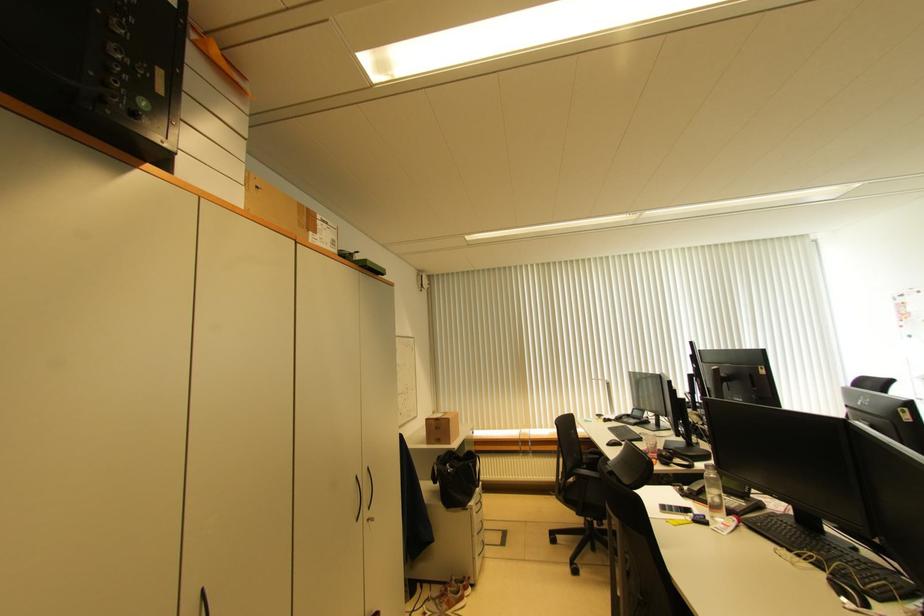
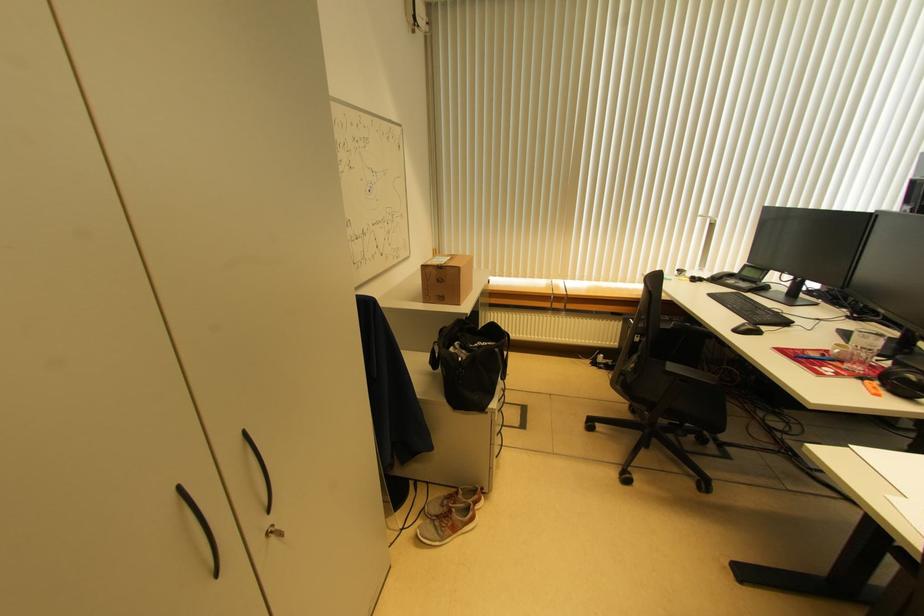
The point at (652, 458) is marked in the first image. Where is the corresponding point in the second image?

(849, 368)